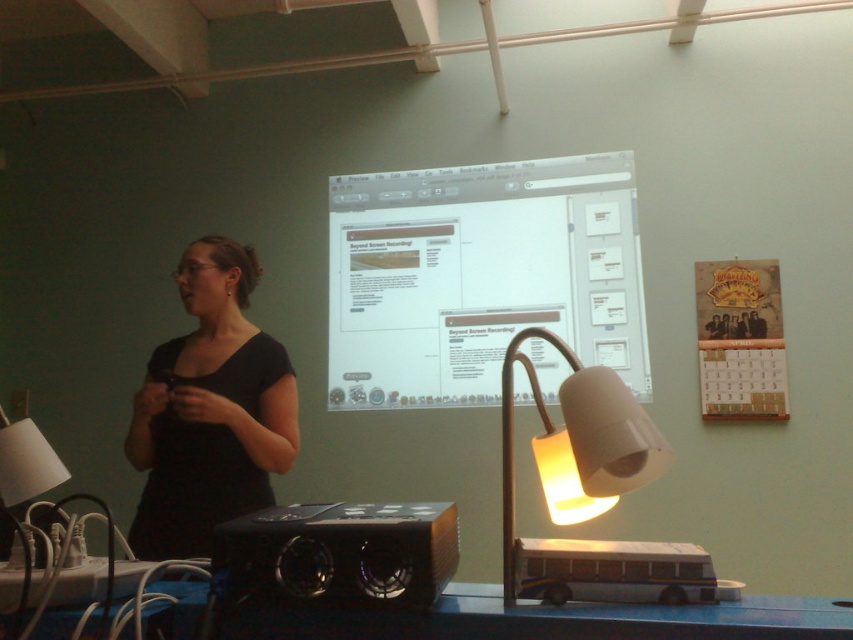
Which of these two, white glossy screen at center or black matte shirt at left, stands taller?

With more height is white glossy screen at center.

Is white glossy screen at center to the right of black matte shirt at left from the viewer's perspective?

Indeed, white glossy screen at center is positioned on the right side of black matte shirt at left.

Does point (482, 168) come farther from viewer compared to point (196, 388)?

Yes, point (482, 168) is behind point (196, 388).

The height and width of the screenshot is (640, 853). Find the location of `white glossy screen at center`. white glossy screen at center is located at coordinates (479, 276).

Is point (375, 182) less distant than point (622, 406)?

No, it is not.

Can you confirm if white glossy screen at center is wider than matte white lamp at center?

Correct, the width of white glossy screen at center exceeds that of matte white lamp at center.

Where is `white glossy screen at center`? The width and height of the screenshot is (853, 640). white glossy screen at center is located at coordinates (479, 276).

The image size is (853, 640). I want to click on white glossy screen at center, so click(479, 276).

In the scene shown: Can you confirm if black matte shirt at left is shorter than matte white lamp at center?

Incorrect, black matte shirt at left's height does not fall short of matte white lamp at center's.

Can you confirm if black matte shirt at left is taller than matte white lamp at center?

Indeed, black matte shirt at left has a greater height compared to matte white lamp at center.

Is point (161, 400) positioned after point (602, 488)?

That is True.

You are a GUI agent. You are given a task and a screenshot of the screen. Output one action in this format:
    pyautogui.click(x=<x>, y=<y>)
    Task: Click on the black matte shirt at left
    This screenshot has width=853, height=640.
    Given the screenshot: What is the action you would take?
    pyautogui.click(x=209, y=410)